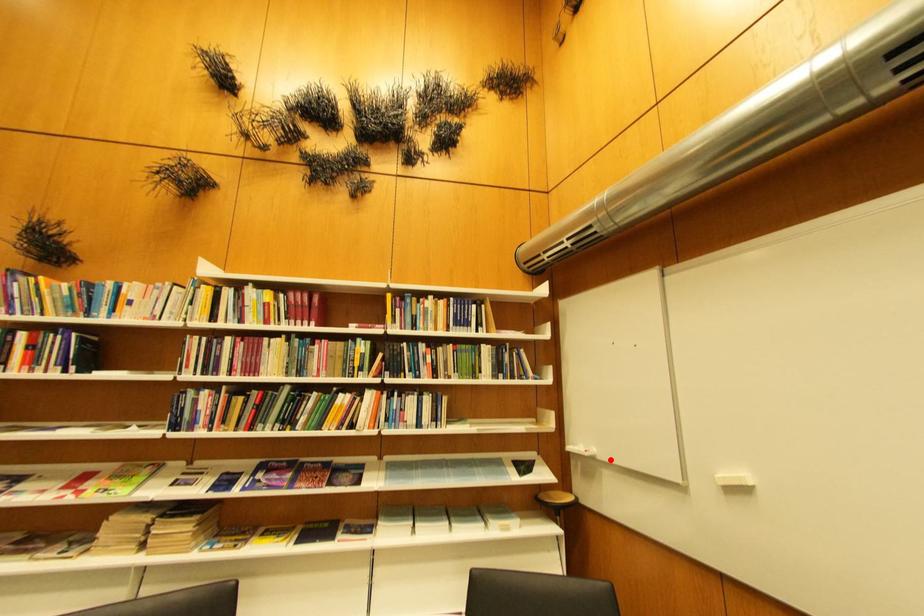
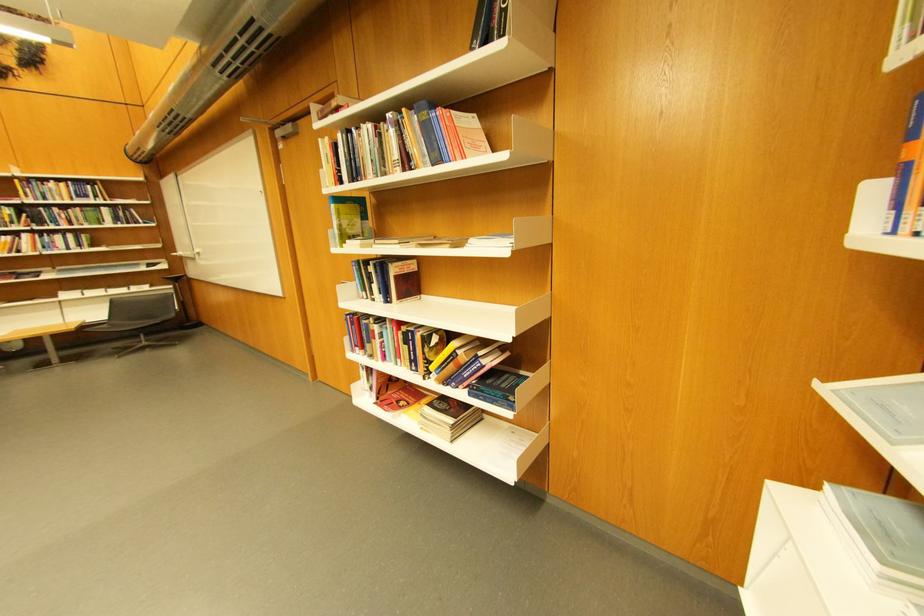
Locate, in the second image, the point that corresponds to the highlighted location in the first image.

(195, 257)